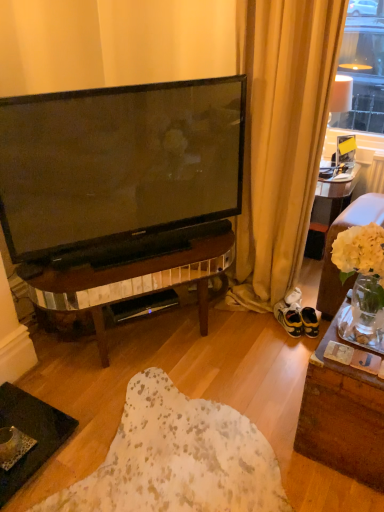
Question: From the image's perspective, is suede brown couch at right positioned above or below yellow suede sneakers at lower right?

Choices:
 (A) below
 (B) above

Answer: (B)

Question: In the image, is suede brown couch at right positioned in front of or behind yellow suede sneakers at lower right?

Choices:
 (A) behind
 (B) front

Answer: (B)

Question: Estimate the real-world distances between objects in this image. Which object is farther from the yellow suede sneakers at lower right?

Choices:
 (A) black plastic speaker at center
 (B) beige fabric curtain at upper right
 (C) suede brown couch at right

Answer: (A)

Question: Which object is the farthest from the yellow suede sneakers at lower right?

Choices:
 (A) beige fabric curtain at upper right
 (B) suede brown couch at right
 (C) black plastic speaker at center

Answer: (C)